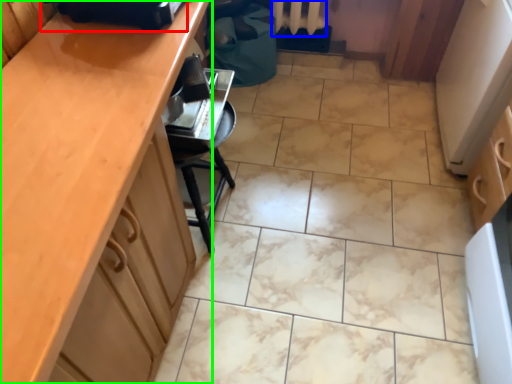
Question: Estimate the real-world distances between objects in this image. Which object is farther from appliance (highlighted by a red box), radiator (highlighted by a blue box) or cabinetry (highlighted by a green box)?

Choices:
 (A) radiator
 (B) cabinetry

Answer: (A)